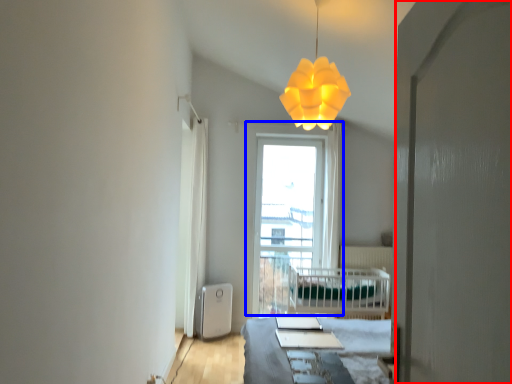
Question: Which object appears farthest to the camera in this image, screen door (highlighted by a red box) or window (highlighted by a blue box)?

Choices:
 (A) screen door
 (B) window

Answer: (B)